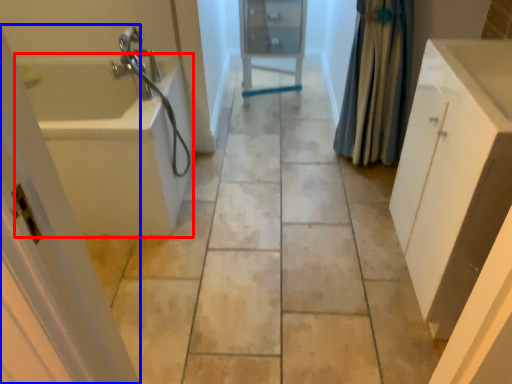
Question: Which object is further to the camera taking this photo, bath (highlighted by a red box) or screen door (highlighted by a blue box)?

Choices:
 (A) bath
 (B) screen door

Answer: (A)